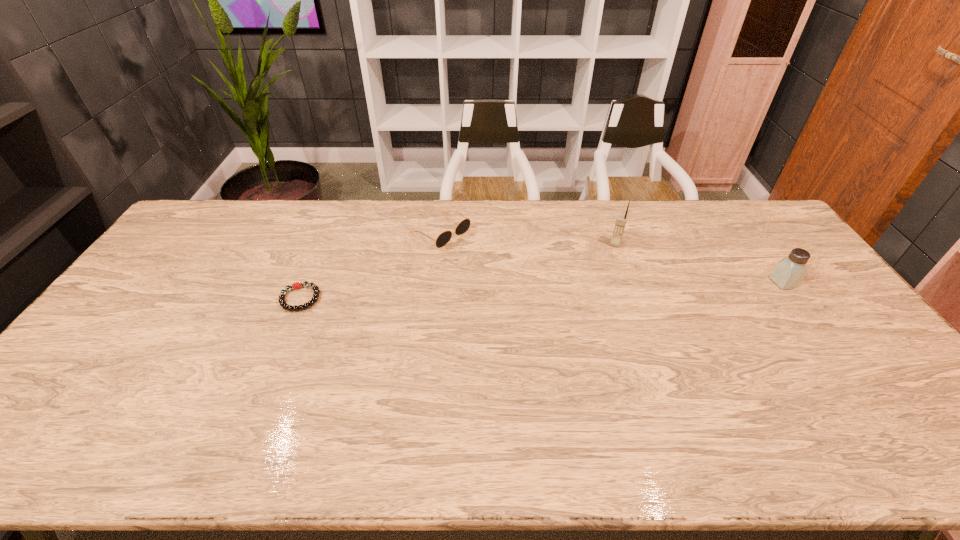
At what (x,y) coordinates should I click in order to perform the action: click on bracelet. Please return your answer as a coordinate pair (x, y). The width and height of the screenshot is (960, 540). Looking at the image, I should click on (298, 285).

Locate an element on the screen. the shortest object is located at coordinates (298, 285).

Where is `the rightmost object`? Image resolution: width=960 pixels, height=540 pixels. the rightmost object is located at coordinates (789, 272).

The width and height of the screenshot is (960, 540). I want to click on saltshaker, so click(789, 272).

Identify the location of the third object from right to left. The height and width of the screenshot is (540, 960). (464, 225).

I want to click on sunglasses, so click(464, 225).

In order to click on the second object from right to left in this screenshot , I will do `click(620, 223)`.

You are a GUI agent. You are given a task and a screenshot of the screen. Output one action in this format:
    pyautogui.click(x=<x>, y=<y>)
    Task: Click on the tallest object
    This screenshot has width=960, height=540.
    Given the screenshot: What is the action you would take?
    pyautogui.click(x=620, y=223)

The width and height of the screenshot is (960, 540). In order to click on vacant space situated on the front of the leftmost object in this screenshot , I will do `click(260, 395)`.

This screenshot has height=540, width=960. I want to click on free point located on the front of the third shortest object, so click(837, 356).